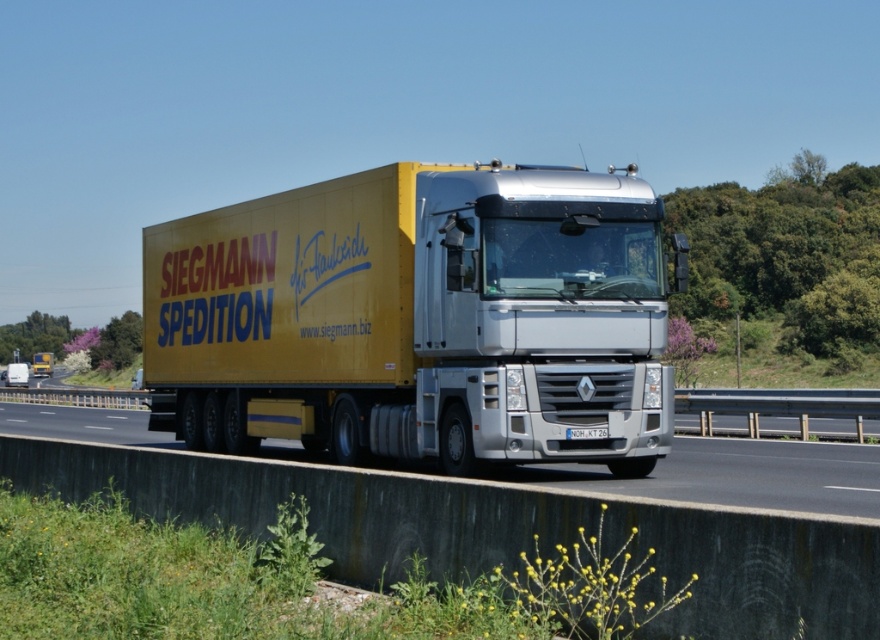
You are a traffic camera analyzing the position of vehicles on the highway. The yellow matte trailer truck at center is represented by point (418, 317). What is the coordinate of the yellow matte trailer truck at center?

The yellow matte trailer truck at center is represented by point (418, 317).

What are the coordinates of the yellow matte trailer truck at center?

The yellow matte trailer truck at center is located at coordinates (418, 317).